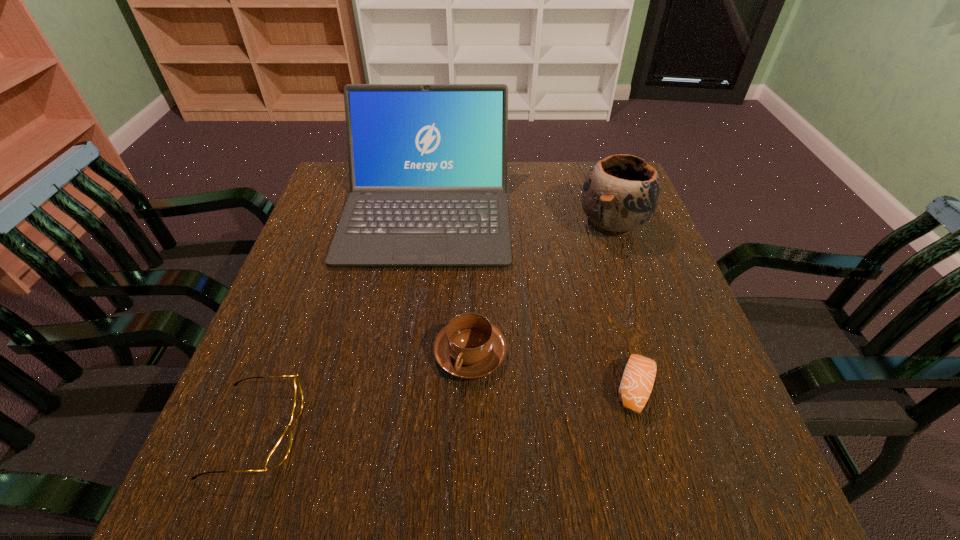
The height and width of the screenshot is (540, 960). What are the coordinates of `laptop computer positioned at the far edge` in the screenshot? It's located at tap(427, 162).

The height and width of the screenshot is (540, 960). I want to click on pottery at the far edge, so click(x=621, y=192).

Find the location of a particular element. The image size is (960, 540). object present at the near edge is located at coordinates (278, 454).

You are a GUI agent. You are given a task and a screenshot of the screen. Output one action in this format:
    pyautogui.click(x=<x>, y=<y>)
    Task: Click on the laptop computer present at the left edge
    This screenshot has width=960, height=540.
    Given the screenshot: What is the action you would take?
    pyautogui.click(x=427, y=162)

You are a GUI agent. You are given a task and a screenshot of the screen. Output one action in this format:
    pyautogui.click(x=<x>, y=<y>)
    Task: Click on the spectacles at the left edge
    The height and width of the screenshot is (540, 960).
    Given the screenshot: What is the action you would take?
    [278, 454]

Locate an element on the screen. pottery that is at the right edge is located at coordinates (621, 192).

I want to click on sushi present at the right edge, so click(x=638, y=378).

Where is `object located at the far left corner`? object located at the far left corner is located at coordinates (427, 162).

What are the coordinates of `object positioned at the near left corner` in the screenshot? It's located at (278, 454).

Find the location of a particular element. This screenshot has height=540, width=960. object located in the far right corner section of the desktop is located at coordinates (621, 192).